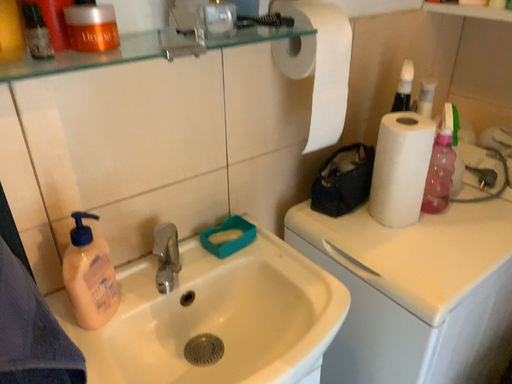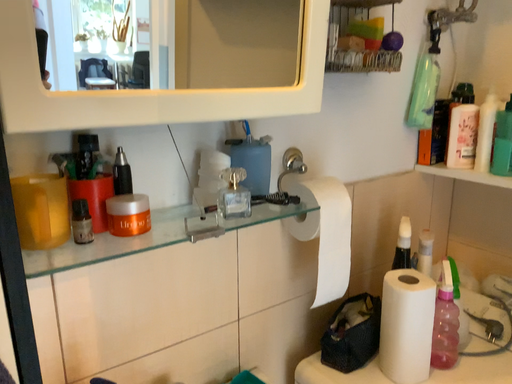
Question: How did the camera likely rotate when shooting the video?

Choices:
 (A) rotated upward
 (B) rotated downward

Answer: (A)